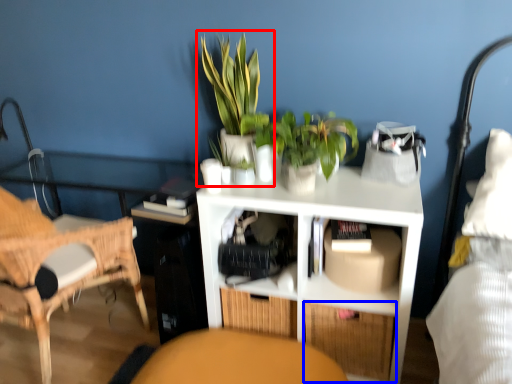
Question: Which object appears farthest to the camera in this image, houseplant (highlighted by a red box) or drawer (highlighted by a blue box)?

Choices:
 (A) houseplant
 (B) drawer

Answer: (B)